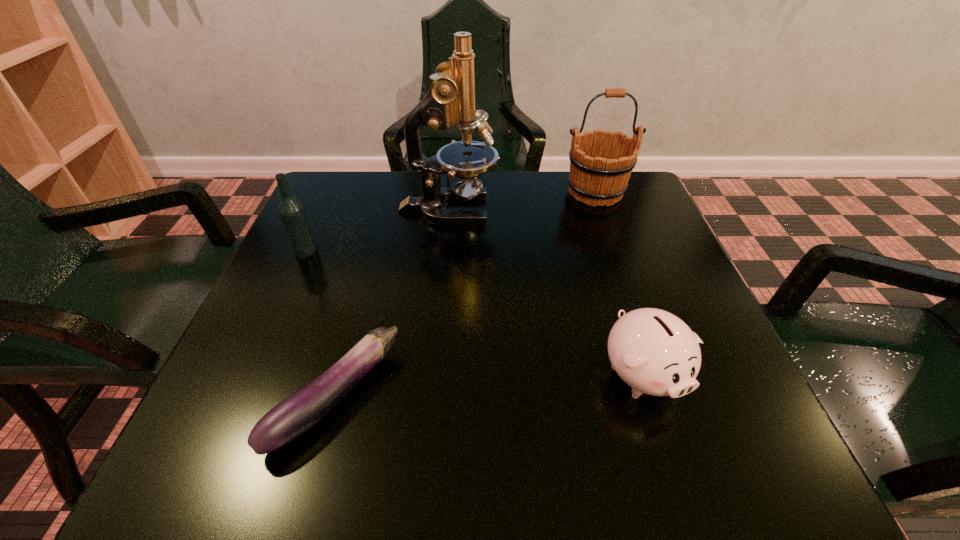
Locate an element on the screen. This screenshot has height=540, width=960. blank region between the third nearest object and the tallest object is located at coordinates (377, 230).

Image resolution: width=960 pixels, height=540 pixels. I want to click on blank region between the piggy bank and the shortest object, so click(x=489, y=386).

Where is `empty space that is in between the fourth shortest object and the piggy bank`? Image resolution: width=960 pixels, height=540 pixels. empty space that is in between the fourth shortest object and the piggy bank is located at coordinates (619, 284).

You are a GUI agent. You are given a task and a screenshot of the screen. Output one action in this format:
    pyautogui.click(x=<x>, y=<y>)
    Task: Click on the blank region between the third farthest object and the tallest object
    
    Given the screenshot: What is the action you would take?
    pyautogui.click(x=377, y=230)

Find the location of a particular element. The image size is (960, 540). vacant space that's between the piggy bank and the tallest object is located at coordinates (545, 292).

Find the location of a particular element. This screenshot has width=960, height=540. unoccupied position between the eggplant and the third farthest object is located at coordinates (321, 325).

Image resolution: width=960 pixels, height=540 pixels. Find the location of `empty space between the fourth shortest object and the shortest object`. empty space between the fourth shortest object and the shortest object is located at coordinates (466, 295).

The height and width of the screenshot is (540, 960). I want to click on vacant space in between the shortest object and the tallest object, so click(x=392, y=303).

This screenshot has width=960, height=540. Find the location of `vacant space in between the fourth shortest object and the eggplant`. vacant space in between the fourth shortest object and the eggplant is located at coordinates (466, 295).

Find the location of a particular element. Image resolution: width=960 pixels, height=540 pixels. object identified as the third closest to the leftmost object is located at coordinates (598, 176).